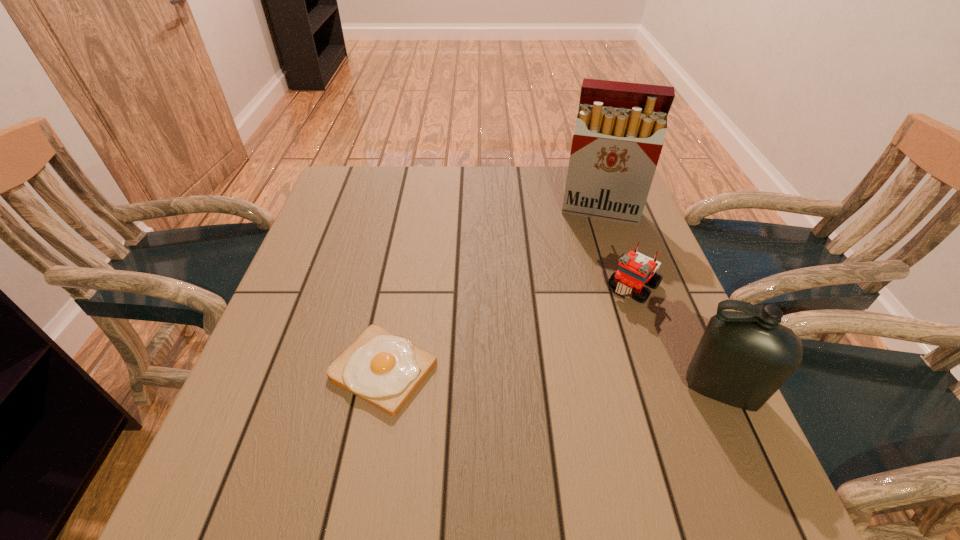
The width and height of the screenshot is (960, 540). I want to click on free spot located with the lid open on the cigarette case, so click(586, 288).

Locate an element on the screen. The image size is (960, 540). free point located with the lid open on the cigarette case is located at coordinates (585, 301).

In order to click on free region located 0.230m on the front-facing side of the Lego in this screenshot , I will do (564, 367).

What are the coordinates of `blank area located on the front-facing side of the Lego` in the screenshot? It's located at (592, 333).

This screenshot has height=540, width=960. In order to click on vacant space located on the front-facing side of the Lego in this screenshot , I will do `click(548, 383)`.

Identify the location of object that is at the far edge. The width and height of the screenshot is (960, 540). (620, 127).

I want to click on toast present at the near edge, so click(x=383, y=369).

Locate an element on the screen. This screenshot has width=960, height=540. bottle that is at the near edge is located at coordinates (743, 358).

The width and height of the screenshot is (960, 540). What are the coordinates of `object that is at the left edge` in the screenshot? It's located at (383, 369).

Where is `bottle that is at the right edge`? This screenshot has height=540, width=960. bottle that is at the right edge is located at coordinates (743, 358).